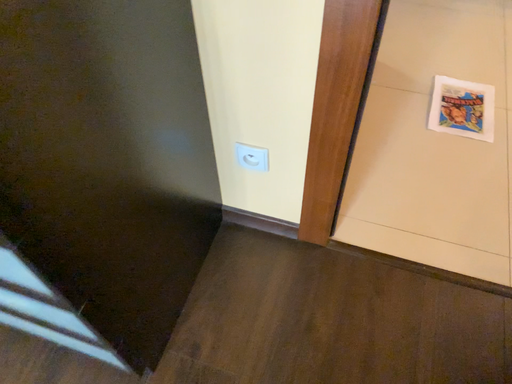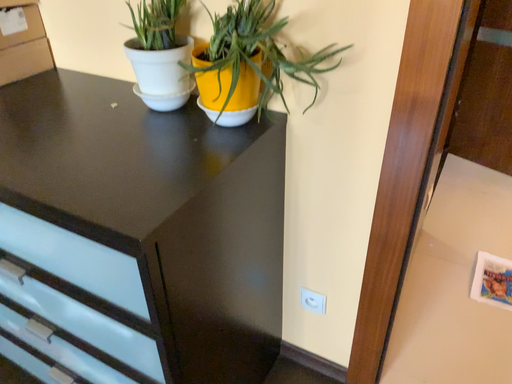
Question: Which way did the camera rotate in the video?

Choices:
 (A) rotated upward
 (B) rotated downward

Answer: (A)